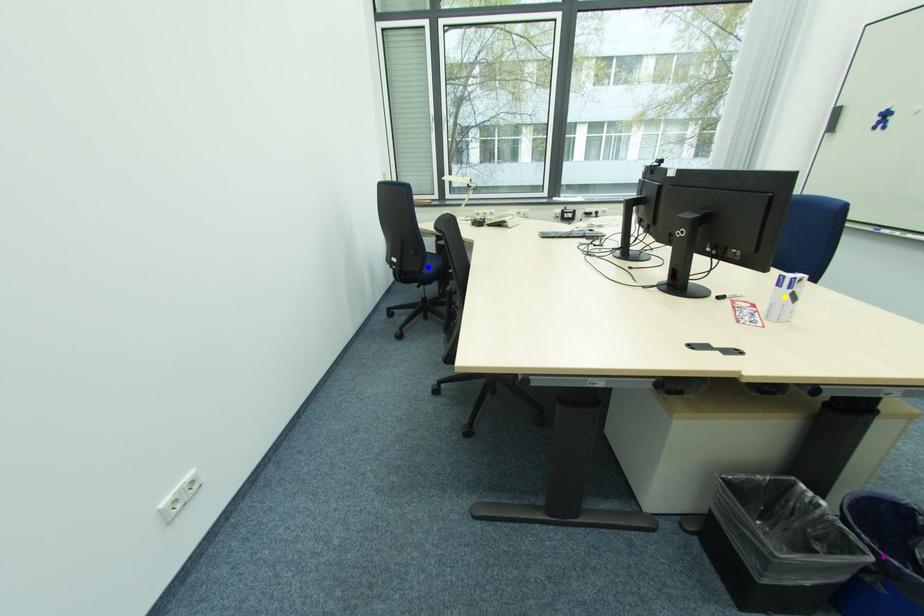
Order these from farthest to nearest:
yellow point | purple point | blue point

blue point
yellow point
purple point